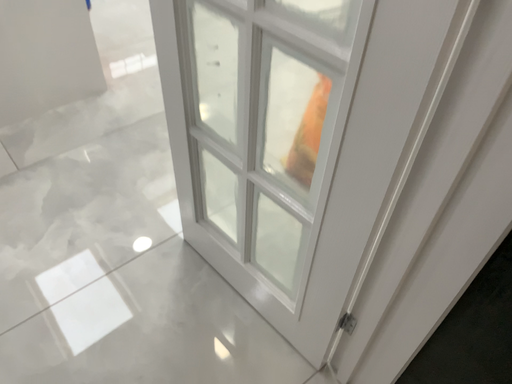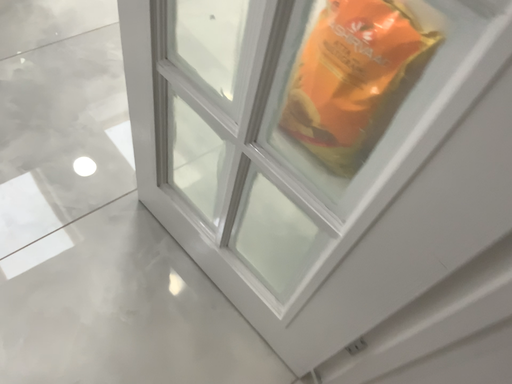
Question: Which way did the camera rotate in the video?

Choices:
 (A) rotated upward
 (B) rotated downward

Answer: (B)